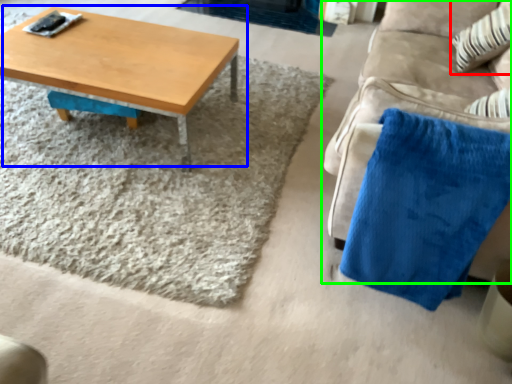
Question: Based on their relative distances, which object is nearer to throw pillow (highlighted by a red box)? Choose from coffee table (highlighted by a blue box) and studio couch (highlighted by a green box).

Choices:
 (A) coffee table
 (B) studio couch

Answer: (B)